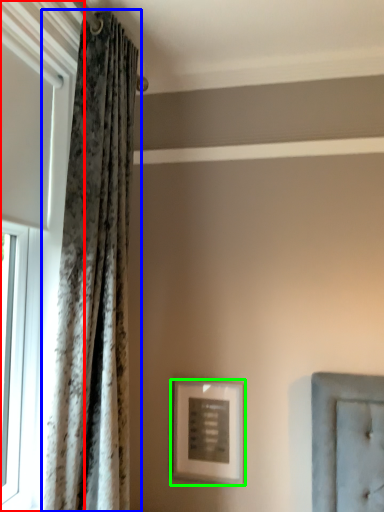
Question: Which is farther away from window (highlighted by a red box)? curtain (highlighted by a blue box) or picture frame (highlighted by a green box)?

Choices:
 (A) curtain
 (B) picture frame

Answer: (B)